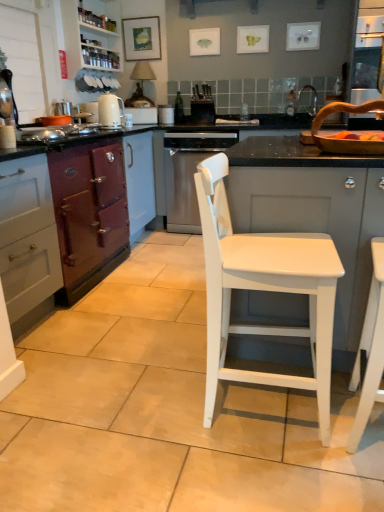
Question: Is matte wooden picture frame at upper center far from black matte oven at center, which is counted as the third appliance, starting from the left?

Choices:
 (A) yes
 (B) no

Answer: (B)

Question: From the image's perspective, is matte wooden picture frame at upper center over black matte oven at center, which is counted as the third appliance, starting from the left?

Choices:
 (A) no
 (B) yes

Answer: (B)

Question: Considering the relative sizes of matte wooden picture frame at upper center and black matte oven at center, which is counted as the third appliance, starting from the left, in the image provided, is matte wooden picture frame at upper center wider than black matte oven at center, which is counted as the third appliance, starting from the left,?

Choices:
 (A) yes
 (B) no

Answer: (B)

Question: Does matte wooden picture frame at upper center come behind black matte oven at center, which is the first appliance in right-to-left order?

Choices:
 (A) no
 (B) yes

Answer: (B)

Question: From a real-world perspective, is matte wooden picture frame at upper center located higher than black matte oven at center, which is the first appliance in right-to-left order?

Choices:
 (A) no
 (B) yes

Answer: (B)

Question: Can you confirm if matte wooden picture frame at upper center is thinner than black matte oven at center, which is counted as the third appliance, starting from the left?

Choices:
 (A) no
 (B) yes

Answer: (B)

Question: Considering the relative sizes of white ceramic toaster at upper center, the first appliance when ordered from left to right, and black matte oven at center, which is the first appliance in right-to-left order, in the image provided, is white ceramic toaster at upper center, the first appliance when ordered from left to right, bigger than black matte oven at center, which is the first appliance in right-to-left order,?

Choices:
 (A) no
 (B) yes

Answer: (B)

Question: From the image's perspective, is white ceramic toaster at upper center, the 3th appliance when ordered from right to left, beneath black matte oven at center, which is the first appliance in right-to-left order?

Choices:
 (A) no
 (B) yes

Answer: (A)

Question: Considering the relative sizes of white ceramic toaster at upper center, the 3th appliance when ordered from right to left, and black matte oven at center, which is counted as the third appliance, starting from the left, in the image provided, is white ceramic toaster at upper center, the 3th appliance when ordered from right to left, wider than black matte oven at center, which is counted as the third appliance, starting from the left,?

Choices:
 (A) no
 (B) yes

Answer: (B)

Question: From a real-world perspective, is white ceramic toaster at upper center, the first appliance when ordered from left to right, located higher than black matte oven at center, which is counted as the third appliance, starting from the left?

Choices:
 (A) yes
 (B) no

Answer: (A)

Question: Is white ceramic toaster at upper center, the 3th appliance when ordered from right to left, taller than black matte oven at center, which is the first appliance in right-to-left order?

Choices:
 (A) no
 (B) yes

Answer: (B)

Question: Would you say white ceramic toaster at upper center, the 3th appliance when ordered from right to left, contains black matte oven at center, which is counted as the third appliance, starting from the left?

Choices:
 (A) no
 (B) yes

Answer: (A)

Question: Is purple matte oven at left, which appears as the first cabinetry when viewed from the left, facing away from white ceramic sink at upper right?

Choices:
 (A) no
 (B) yes

Answer: (A)